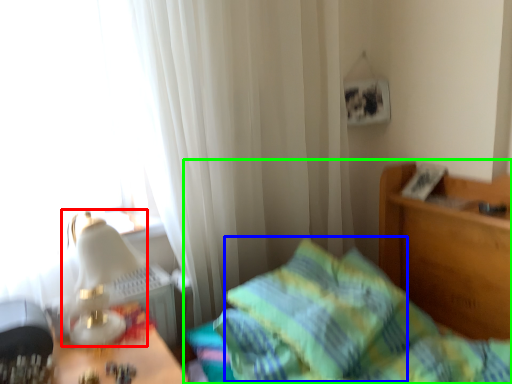
Question: Based on their relative distances, which object is nearer to table lamp (highlighted by a red box)? Choose from pillow (highlighted by a blue box) and bed (highlighted by a green box).

Choices:
 (A) pillow
 (B) bed

Answer: (A)